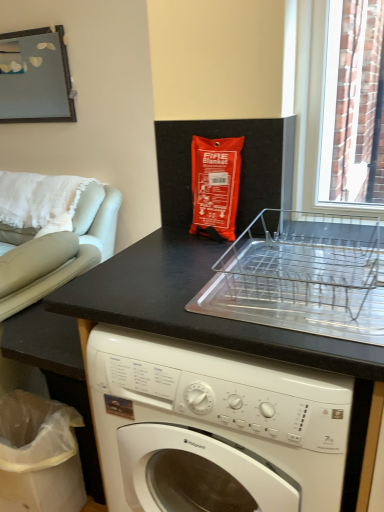
Question: Considering the relative sizes of clear plastic dish rack at center and light gray leather armchair at left in the image provided, is clear plastic dish rack at center shorter than light gray leather armchair at left?

Choices:
 (A) yes
 (B) no

Answer: (A)

Question: Is clear plastic dish rack at center wider than light gray leather armchair at left?

Choices:
 (A) no
 (B) yes

Answer: (A)

Question: Does clear plastic dish rack at center touch light gray leather armchair at left?

Choices:
 (A) yes
 (B) no

Answer: (B)

Question: Is clear plastic dish rack at center positioned in front of light gray leather armchair at left?

Choices:
 (A) yes
 (B) no

Answer: (A)

Question: Can we say clear plastic dish rack at center lies outside light gray leather armchair at left?

Choices:
 (A) no
 (B) yes

Answer: (B)

Question: In terms of height, does metallic mirror at upper left look taller or shorter compared to white plastic bag at lower left?

Choices:
 (A) short
 (B) tall

Answer: (B)

Question: Do you think metallic mirror at upper left is within white plastic bag at lower left, or outside of it?

Choices:
 (A) outside
 (B) inside

Answer: (A)

Question: Is metallic mirror at upper left wider or thinner than white plastic bag at lower left?

Choices:
 (A) wide
 (B) thin

Answer: (B)

Question: Would you say metallic mirror at upper left is to the left or to the right of white plastic bag at lower left in the picture?

Choices:
 (A) left
 (B) right

Answer: (A)

Question: In the image, is white plastic bag at lower left on the left side or the right side of black matte counter at lower left?

Choices:
 (A) right
 (B) left

Answer: (B)

Question: From a real-world perspective, is white plastic bag at lower left physically located above or below black matte counter at lower left?

Choices:
 (A) above
 (B) below

Answer: (B)

Question: Considering the positions of point (71, 436) and point (18, 335), is point (71, 436) closer or farther from the camera than point (18, 335)?

Choices:
 (A) farther
 (B) closer

Answer: (A)

Question: From the image's perspective, is white plastic bag at lower left located above or below black matte counter at lower left?

Choices:
 (A) below
 (B) above

Answer: (A)

Question: Do you think white plastic bag at lower left is within metallic mirror at upper left, or outside of it?

Choices:
 (A) inside
 (B) outside

Answer: (B)

Question: From the image's perspective, is white plastic bag at lower left positioned above or below metallic mirror at upper left?

Choices:
 (A) above
 (B) below

Answer: (B)